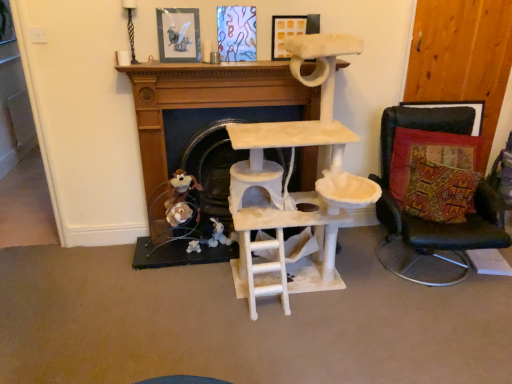
Question: Is fuzzy brown plush at lower center not within multicolored woven cushion at right?

Choices:
 (A) yes
 (B) no

Answer: (A)

Question: From the image's perspective, is fuzzy brown plush at lower center on top of multicolored woven cushion at right?

Choices:
 (A) no
 (B) yes

Answer: (B)

Question: From a real-world perspective, is fuzzy brown plush at lower center on top of multicolored woven cushion at right?

Choices:
 (A) no
 (B) yes

Answer: (A)

Question: Is multicolored woven cushion at right at the back of fuzzy brown plush at lower center?

Choices:
 (A) no
 (B) yes

Answer: (A)

Question: From the image's perspective, would you say fuzzy brown plush at lower center is shown under multicolored woven cushion at right?

Choices:
 (A) yes
 (B) no

Answer: (B)

Question: Is black leather chair at right bigger or smaller than matte yellow picture frame at upper center, which is the 2th picture frame from left to right?

Choices:
 (A) big
 (B) small

Answer: (A)

Question: Relative to matte yellow picture frame at upper center, which is the 2th picture frame from left to right, is black leather chair at right in front or behind?

Choices:
 (A) behind
 (B) front

Answer: (B)

Question: Considering the relative positions of black leather chair at right and matte yellow picture frame at upper center, placed as the 1th picture frame when sorted from right to left, in the image provided, is black leather chair at right to the left or to the right of matte yellow picture frame at upper center, placed as the 1th picture frame when sorted from right to left,?

Choices:
 (A) left
 (B) right

Answer: (B)

Question: Is black leather chair at right wider or thinner than matte yellow picture frame at upper center, which is the 2th picture frame from left to right?

Choices:
 (A) wide
 (B) thin

Answer: (A)

Question: Is matte yellow picture frame at upper center, which is the 2th picture frame from left to right, bigger or smaller than fuzzy brown plush at lower center?

Choices:
 (A) small
 (B) big

Answer: (A)

Question: Is matte yellow picture frame at upper center, which is the 2th picture frame from left to right, inside the boundaries of fuzzy brown plush at lower center, or outside?

Choices:
 (A) inside
 (B) outside

Answer: (B)

Question: Based on their positions, is matte yellow picture frame at upper center, placed as the 1th picture frame when sorted from right to left, located to the left or right of fuzzy brown plush at lower center?

Choices:
 (A) left
 (B) right

Answer: (B)

Question: Is matte yellow picture frame at upper center, which is the 2th picture frame from left to right, wider or thinner than fuzzy brown plush at lower center?

Choices:
 (A) wide
 (B) thin

Answer: (B)

Question: From the image's perspective, is matte glass picture frame at upper center, the 2th picture frame viewed from the right, above or below matte yellow picture frame at upper center, which is the 2th picture frame from left to right?

Choices:
 (A) below
 (B) above

Answer: (A)

Question: Looking at the image, does matte glass picture frame at upper center, which is the 1th picture frame in left-to-right order, seem bigger or smaller compared to matte yellow picture frame at upper center, which is the 2th picture frame from left to right?

Choices:
 (A) small
 (B) big

Answer: (B)